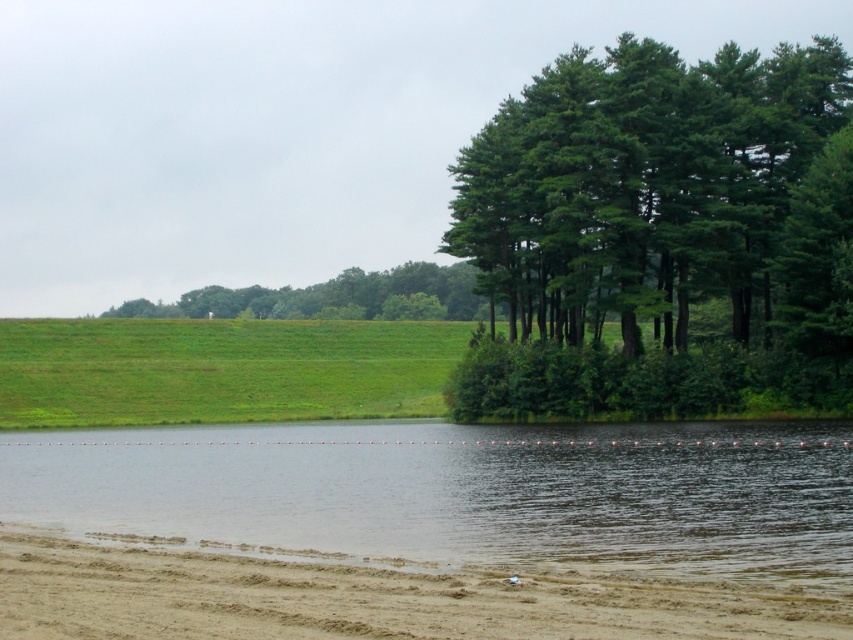
You are standing at the center of the image and want to walk to the brown sandy dirt track at lower left. Which direction should you head?

To reach the brown sandy dirt track at lower left from the center, you should head towards the lower left direction.

You are planning to set up a picnic area and need to choose between the brown sandy dirt track at lower left and the green leafy tree at center. Which location has more space for setting up your picnic?

The green leafy tree at center has more space for setting up your picnic because the brown sandy dirt track at lower left occupies less space than it.